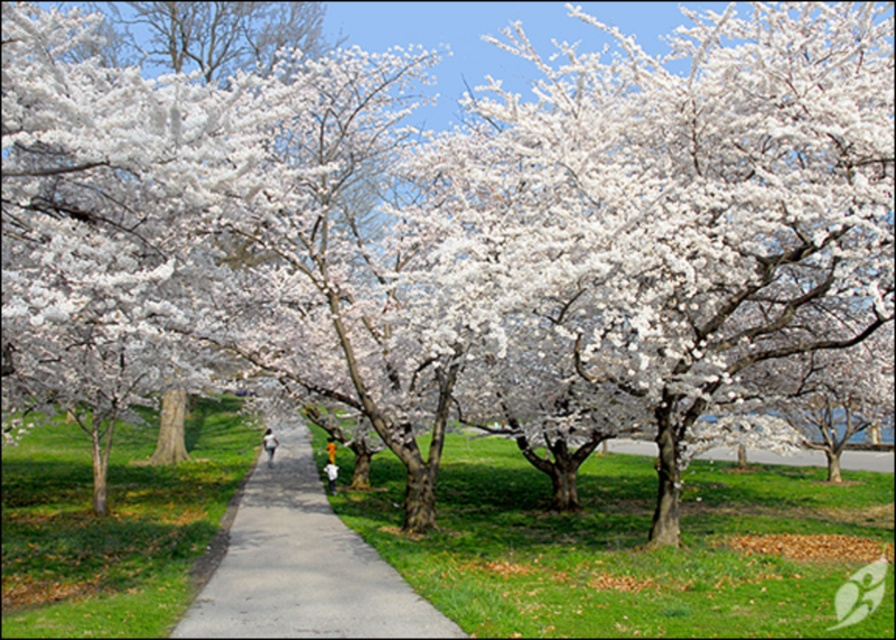
Which of these two, gray concrete pavement at center or white fluffy petals at center, stands shorter?

gray concrete pavement at center is shorter.

Is gray concrete pavement at center positioned before white fluffy petals at center?

No.

The width and height of the screenshot is (896, 640). What are the coordinates of `gray concrete pavement at center` in the screenshot? It's located at (300, 564).

Where is `gray concrete pavement at center`? The height and width of the screenshot is (640, 896). gray concrete pavement at center is located at coordinates (300, 564).